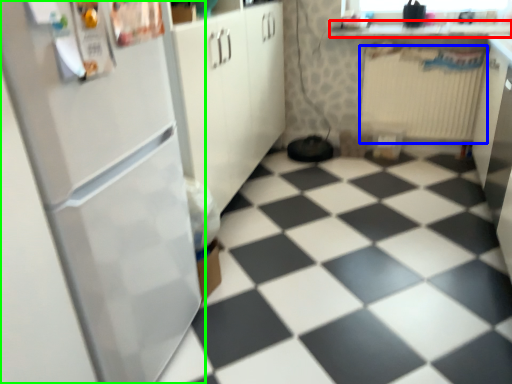
Question: Which object is positioned closest to counter top (highlighted by a red box)? Select from radiator (highlighted by a blue box) and refrigerator (highlighted by a green box).

Choices:
 (A) radiator
 (B) refrigerator

Answer: (A)